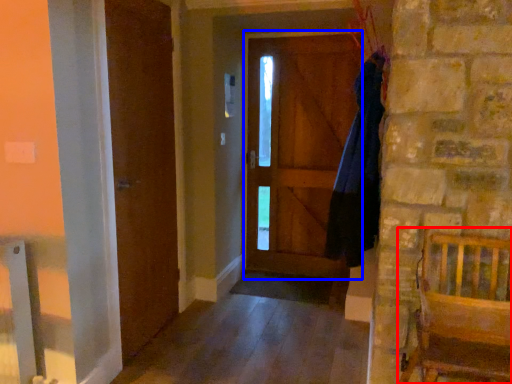
Question: Which object appears farthest to the camera in this image, furniture (highlighted by a red box) or screen door (highlighted by a blue box)?

Choices:
 (A) furniture
 (B) screen door

Answer: (B)